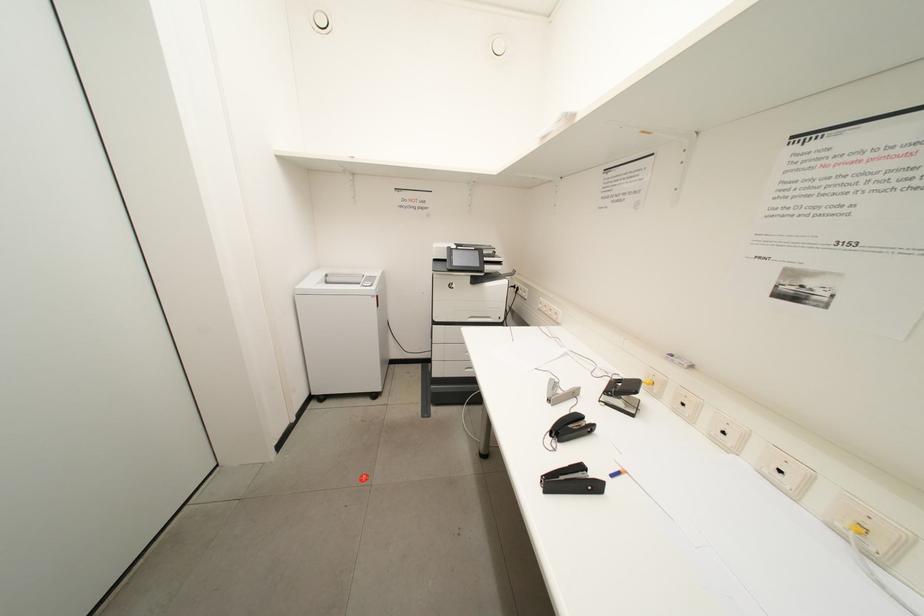
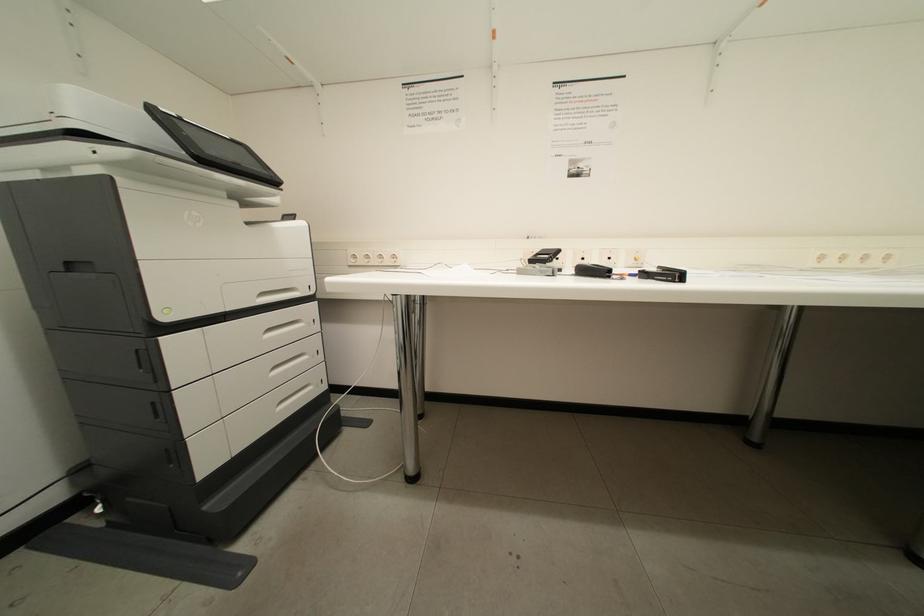
Question: The camera is either moving clockwise (left) or counter-clockwise (right) around the object. The first image is from the beginning of the video and the second image is from the end. Is the camera moving left or right when shooting the video?

Choices:
 (A) Left
 (B) Right

Answer: (A)